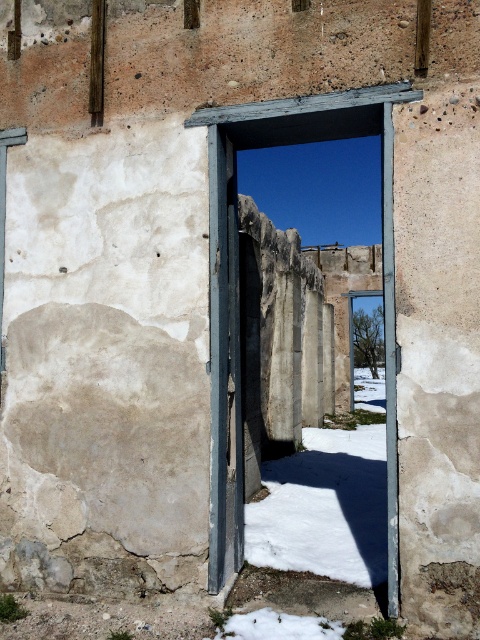
Does wooden door frame at center appear on the right side of rusty metal door at center?

Indeed, wooden door frame at center is positioned on the right side of rusty metal door at center.

Which is behind, point (224, 240) or point (225, 369)?

The point (224, 240) is behind.

This screenshot has width=480, height=640. I want to click on wooden door frame at center, so tap(228, 252).